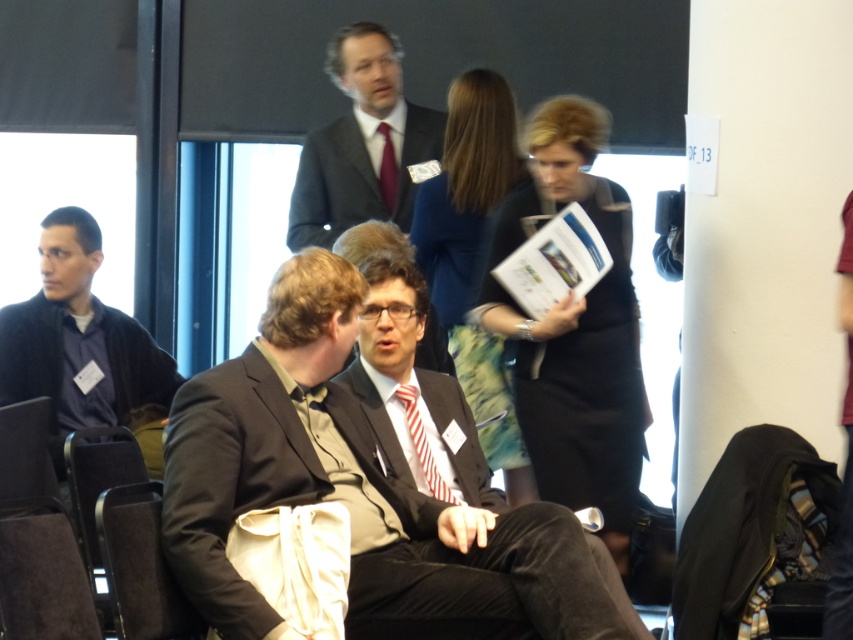
You are a photographer taking a picture of the conference scene. You notice two points in the image at coordinates point (467,614) and point (437,484). Which point is closer to your camera lens?

Point (467,614) is closer to the camera lens than point (437,484).

You are organizing a photo shoot and need to arrange the matte black suit at center and the red striped tie at center in a way that maintains their original height relationship. Which object should be placed higher in the frame?

The matte black suit at center should be placed higher in the frame since it has a greater height compared to the red striped tie at center.

You are attending a conference and need to sit down. You see the dark gray sweater at left and the dark brown leather chair at lower left. Which object is closer to the floor?

The dark brown leather chair at lower left is closer to the floor because it is below the dark gray sweater at left.